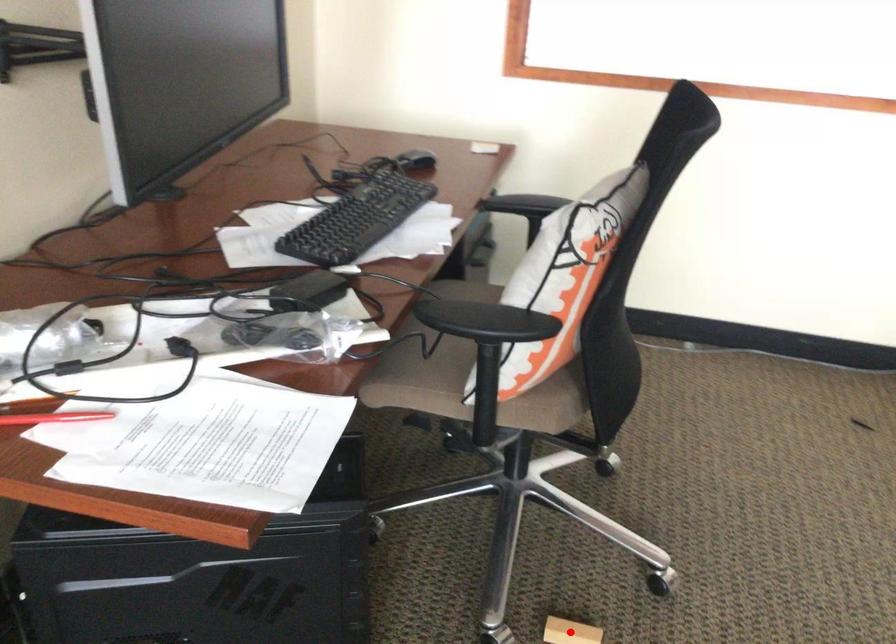
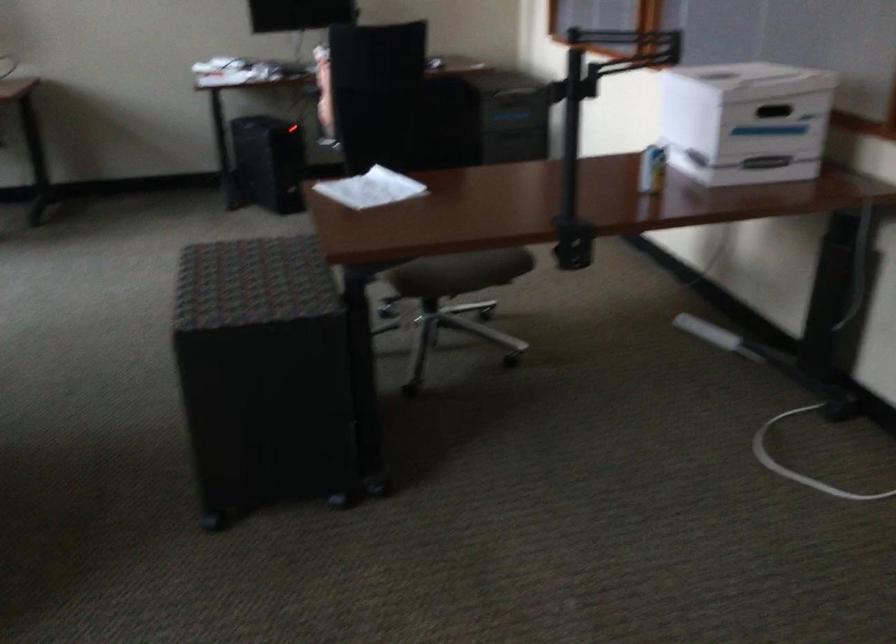
Question: I am providing you with two images of the same scene from different viewpoints. A red point is marked on the first image. Is the red point's position out of view in image 2?

Choices:
 (A) Yes
 (B) No

Answer: (A)